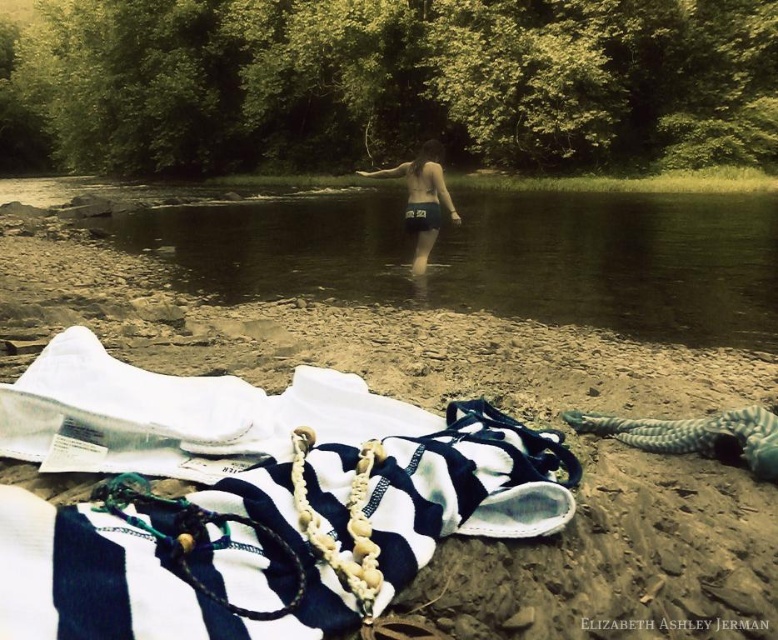
You are a photographer setting up a shoot at the riverside. You have two items to place in the scene for the shoot. The items are the white fabric at lower left and the dark blue fabric shorts at center. According to the scene description, where should you place each item to match the original image?

The white fabric at lower left should be placed below the dark blue fabric shorts at center, as per the scene description.

You are standing on the riverside and want to place your dark blue fabric shorts at center near the clear water at center. Based on the scene description, which direction should you move your shorts to align them with the water?

The clear water at center is to the left of dark blue fabric shorts at center, so you should move the dark blue fabric shorts at center to the left to align them with the clear water at center.

You are planning to lay out a picnic blanket on the sand near the white fabric at lower left and the clear water at center. Which area has enough space to accommodate the blanket?

The clear water at center has more space than the white fabric at lower left, so it can accommodate the picnic blanket better.